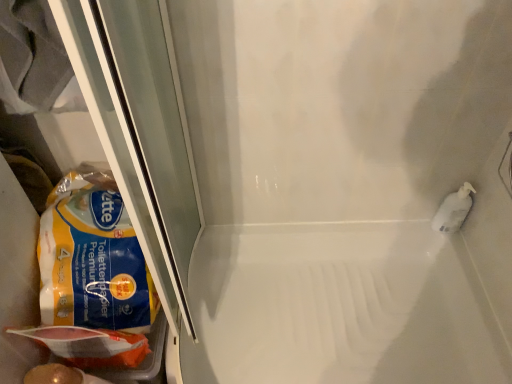
Question: Is point (507, 369) closer or farther from the camera than point (55, 190)?

Choices:
 (A) farther
 (B) closer

Answer: (A)

Question: Is white glossy bath at center spatially inside yellow matte paper towel at left, or outside of it?

Choices:
 (A) inside
 (B) outside

Answer: (B)

Question: Estimate the real-world distances between objects in this image. Which object is farther from the white glossy bath at center?

Choices:
 (A) yellow matte paper towel at left
 (B) matte plastic bag at lower left

Answer: (B)

Question: Based on their relative distances, which object is farther from the yellow matte paper towel at left?

Choices:
 (A) matte plastic bag at lower left
 (B) white glossy bath at center

Answer: (B)